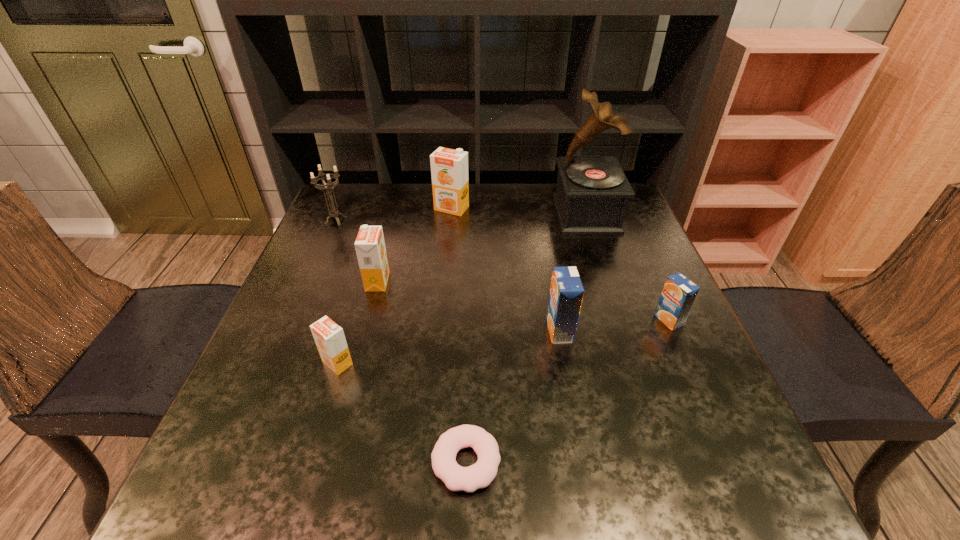
Where is `the tallest object`? the tallest object is located at coordinates (592, 192).

At what (x,y) coordinates should I click in order to perform the action: click on the rightmost orange orange juice. Please return your answer as a coordinate pair (x, y). Looking at the image, I should click on (449, 168).

I want to click on the biggest orange orange juice, so click(449, 168).

Locate an element on the screen. This screenshot has height=540, width=960. candle holder is located at coordinates (334, 213).

The image size is (960, 540). I want to click on the second smallest orange orange juice, so click(x=370, y=247).

You are a GUI agent. You are given a task and a screenshot of the screen. Output one action in this format:
    pyautogui.click(x=<x>, y=<y>)
    Task: Click on the fourth farthest object
    
    Given the screenshot: What is the action you would take?
    pyautogui.click(x=370, y=247)

Locate an element on the screen. the bigger blue orange_juice is located at coordinates (566, 294).

The height and width of the screenshot is (540, 960). I want to click on the fourth orange juice from left to right, so click(x=566, y=294).

You are a GUI agent. You are given a task and a screenshot of the screen. Output one action in this format:
    pyautogui.click(x=<x>, y=<y>)
    Task: Click on the smaller blue orange_juice
    The width and height of the screenshot is (960, 540).
    Given the screenshot: What is the action you would take?
    pyautogui.click(x=679, y=293)

Locate an element on the screen. The width and height of the screenshot is (960, 540). the rightmost orange juice is located at coordinates (679, 293).